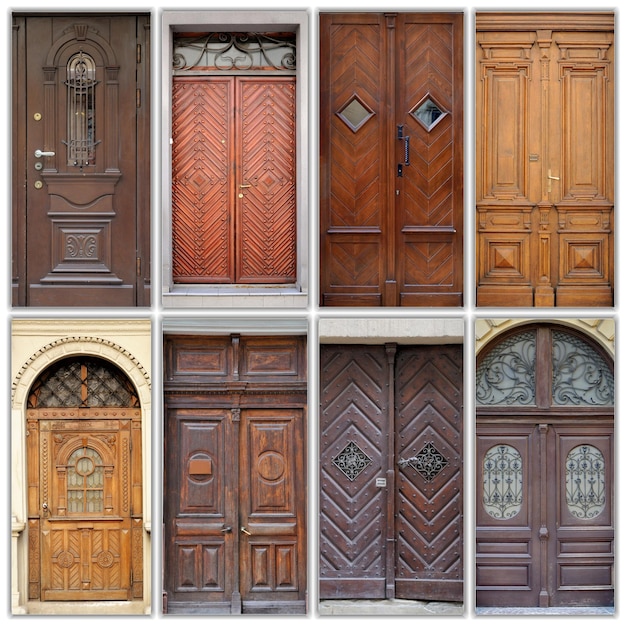
I want to click on windows, so click(x=80, y=96), click(x=242, y=42), click(x=357, y=114), click(x=438, y=111), click(x=506, y=372), click(x=581, y=372), click(x=587, y=496), click(x=513, y=485), click(x=81, y=481), click(x=61, y=382).